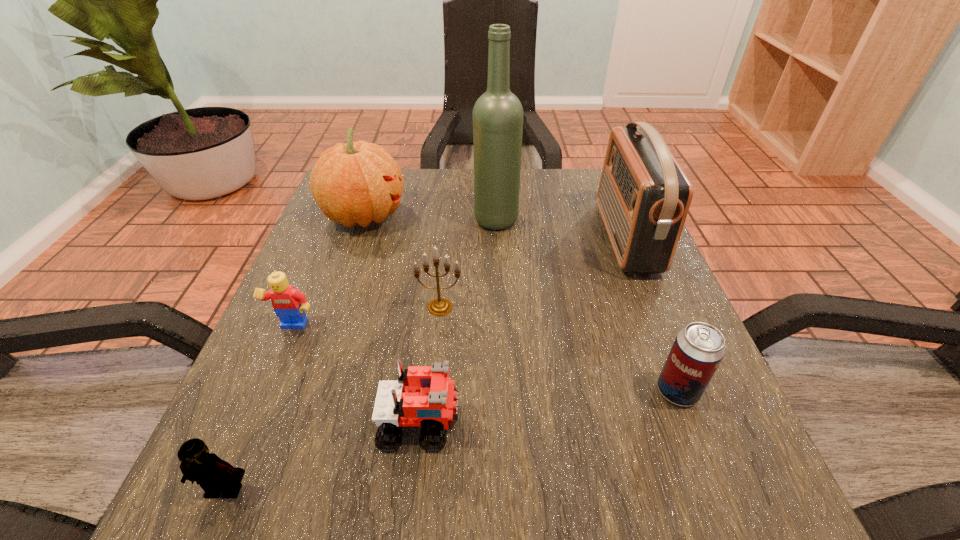
At what (x,y) coordinates should I click in order to perform the action: click on blank space located on the front-facing side of the radio receiver. Please return your answer as a coordinate pair (x, y). The height and width of the screenshot is (540, 960). Looking at the image, I should click on (447, 238).

This screenshot has width=960, height=540. In order to click on free location located 0.390m on the front-facing side of the radio receiver in this screenshot , I will do `click(429, 238)`.

The image size is (960, 540). I want to click on vacant point located on the front-facing side of the radio receiver, so click(542, 238).

At what (x,y) coordinates should I click in order to perform the action: click on free location located on the carved face of the sixth shortest object. Please return your answer as a coordinate pair (x, y). The width and height of the screenshot is (960, 540). Looking at the image, I should click on (487, 215).

This screenshot has height=540, width=960. I want to click on vacant area situated on the front of the candelabrum, so click(432, 387).

This screenshot has height=540, width=960. Find the location of `vacant position located on the left of the beer can`. vacant position located on the left of the beer can is located at coordinates (398, 391).

Locate an element on the screen. The width and height of the screenshot is (960, 540). vacant area located 0.130m on the face of the farthest Lego is located at coordinates (262, 406).

This screenshot has width=960, height=540. I want to click on free spot located 0.190m on the front-facing side of the rightmost Lego, so click(589, 422).

You are a GUI agent. You are given a task and a screenshot of the screen. Output one action in this format:
    pyautogui.click(x=<x>, y=<y>)
    Task: Click on the wine bottle that is at the far edge
    
    Given the screenshot: What is the action you would take?
    pyautogui.click(x=498, y=115)

I want to click on radio receiver that is at the far edge, so click(644, 196).